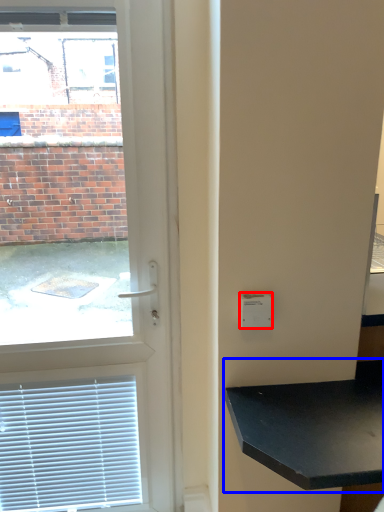
Question: Which object is further to the camera taking this photo, light switch (highlighted by a red box) or table (highlighted by a blue box)?

Choices:
 (A) light switch
 (B) table

Answer: (A)